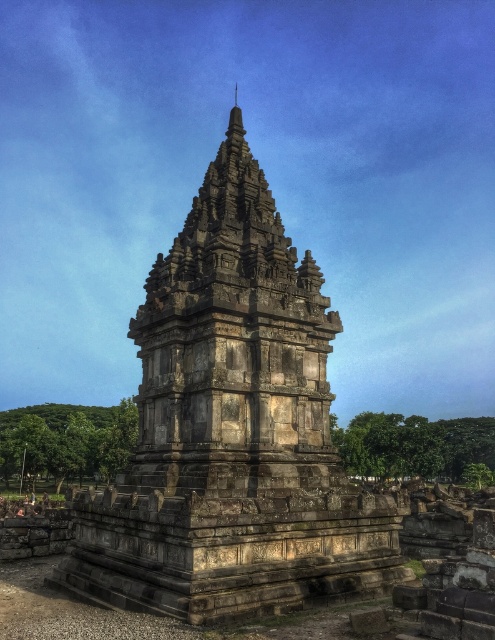
Who is taller, stone temple at center or gray stone tower at center?

stone temple at center

Identify the location of stone temple at center. The height and width of the screenshot is (640, 495). (232, 433).

In order to click on stone temple at center in this screenshot , I will do `click(232, 433)`.